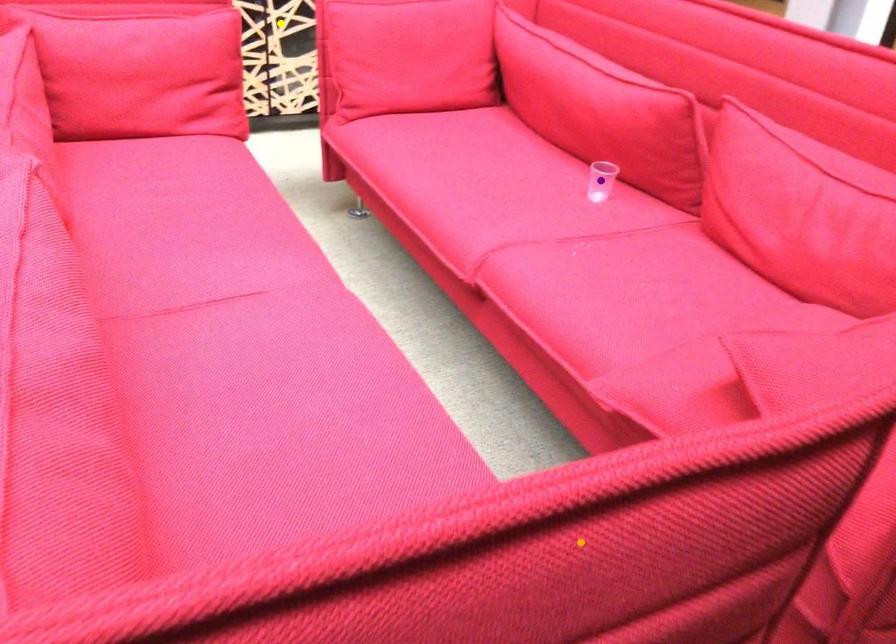
Consider the image. Order these from farthest to nearest:
- orange point
- purple point
- yellow point

yellow point → purple point → orange point